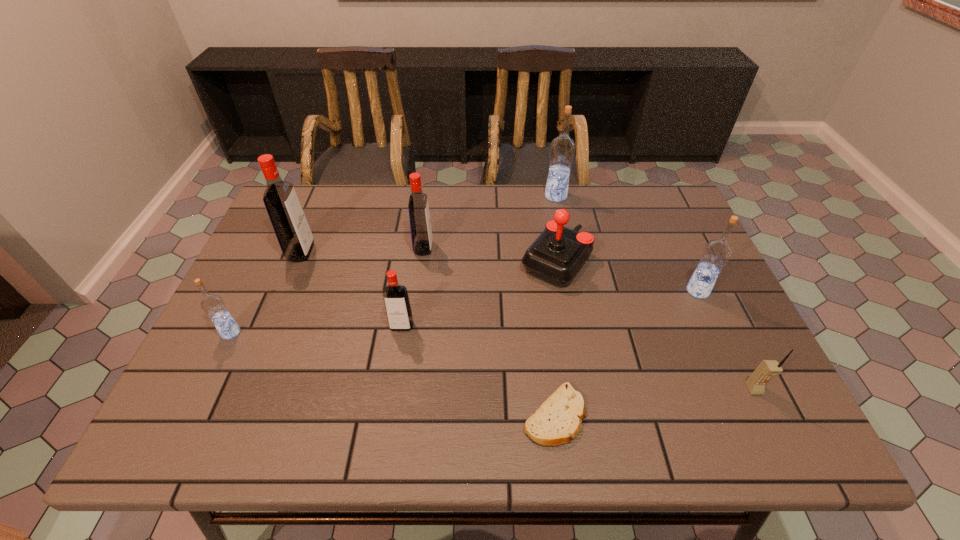
Locate an element on the screen. The image size is (960, 540). free point that satisfies the following two spatial constraints: 1. on the front and back of the leftmost red vodka; 2. on the back side of the rightmost blue vodka is located at coordinates (285, 291).

Where is `blank space that satisfies the following two spatial constraints: 1. on the front and back of the second biggest red vodka; 2. on the front and back of the smallest red vodka`? The height and width of the screenshot is (540, 960). blank space that satisfies the following two spatial constraints: 1. on the front and back of the second biggest red vodka; 2. on the front and back of the smallest red vodka is located at coordinates coord(413,326).